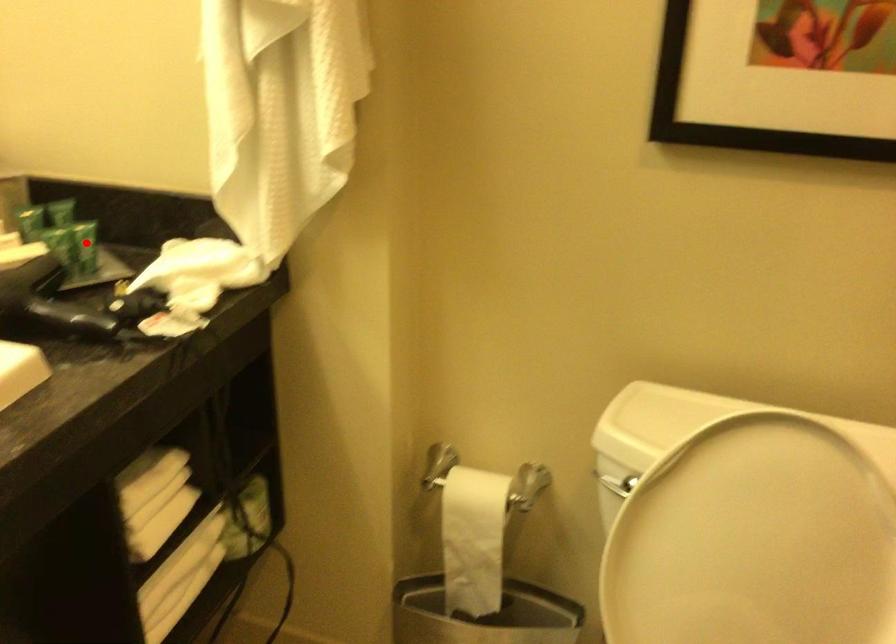
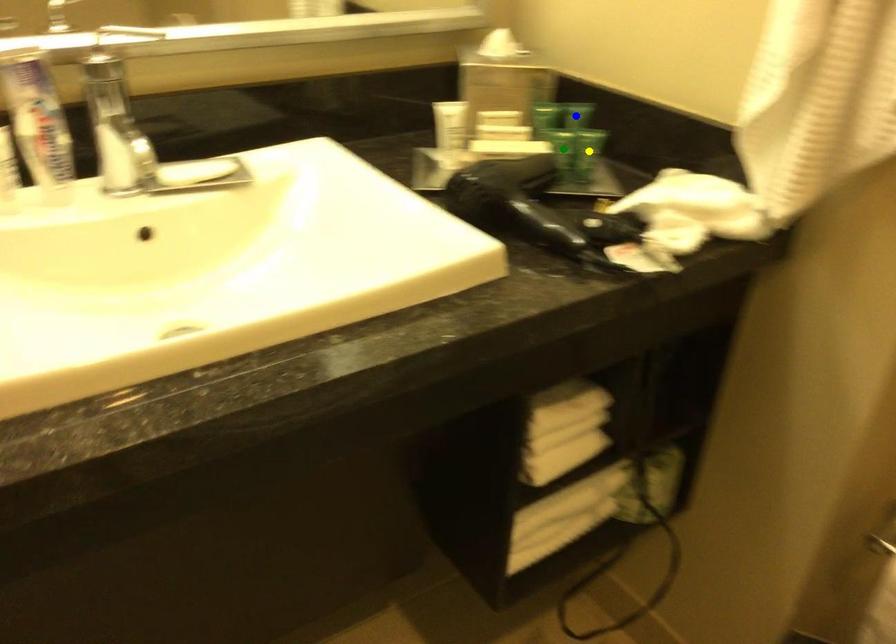
Question: I am providing you with two images of the same scene from different viewpoints. A red point is marked on the first image. You are given multiple points on the second image. Can you choose the point in image 2 that corresponds to the point in image 1?

Choices:
 (A) green point
 (B) yellow point
 (C) blue point

Answer: (B)